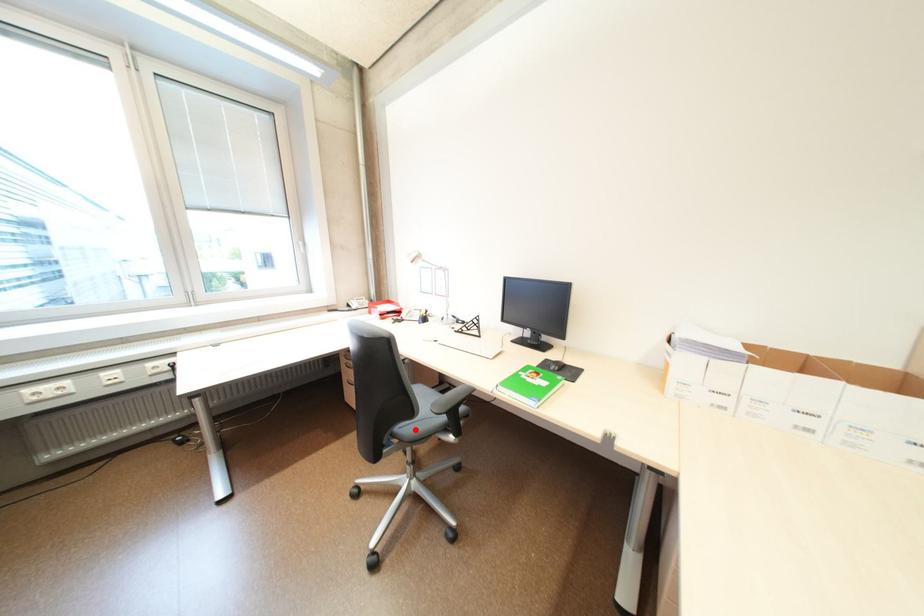
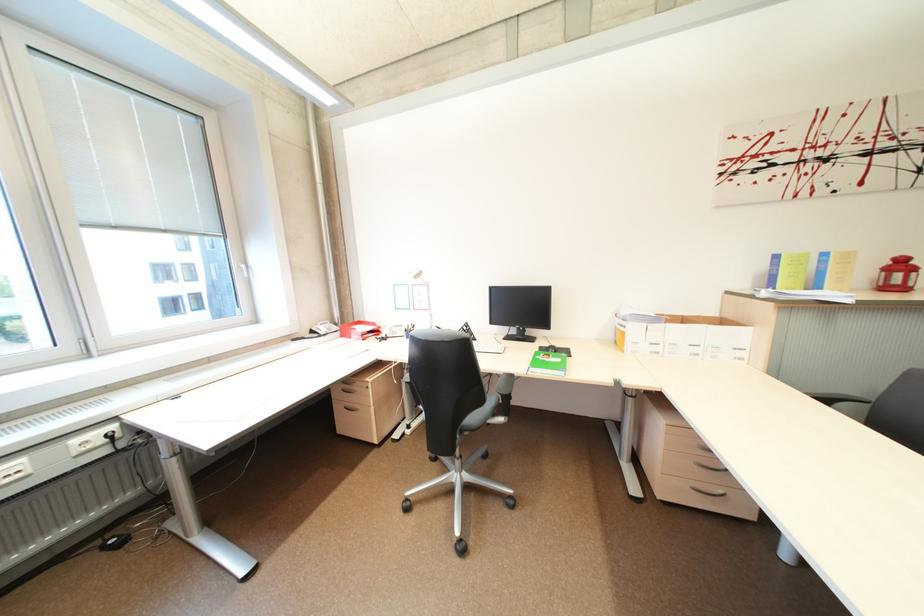
Where in the second image is the point corresponding to the highlighted location from the first image?

(482, 419)